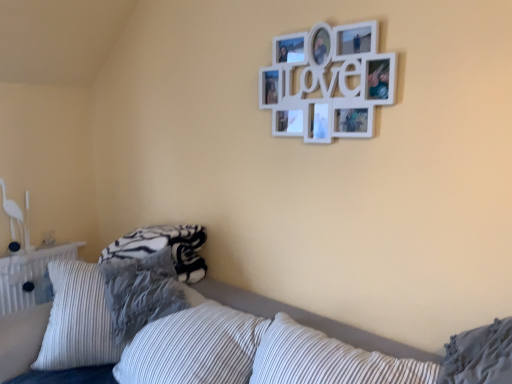
Where is `vacant space in white matte picture frame at upper center (from a real-world perspective)`? The width and height of the screenshot is (512, 384). vacant space in white matte picture frame at upper center (from a real-world perspective) is located at coordinates (306, 309).